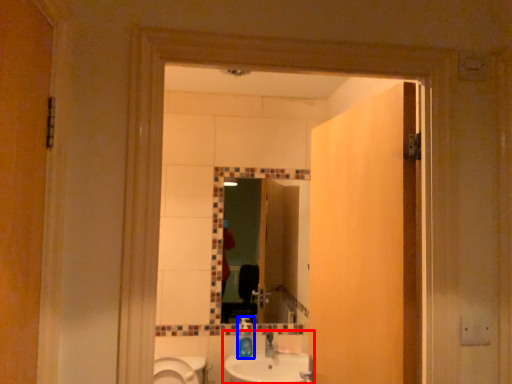
Question: Which object appears farthest to the camera in this image, sink (highlighted by a red box) or bottle (highlighted by a blue box)?

Choices:
 (A) sink
 (B) bottle

Answer: (B)